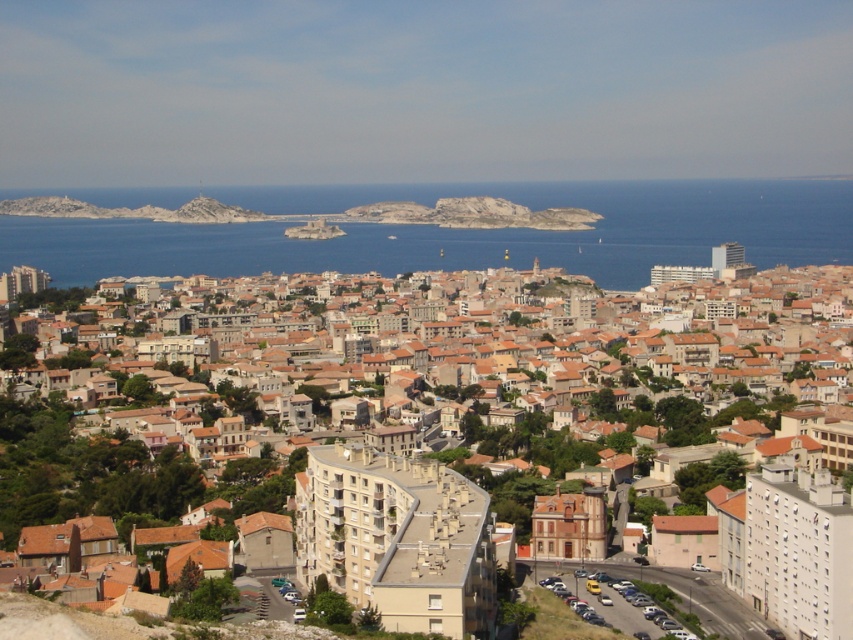
Question: Among these points, which one is farthest from the camera?

Choices:
 (A) (254, 257)
 (B) (401, 436)

Answer: (A)

Question: Which object is closer to the camera taking this photo?

Choices:
 (A) brown textured buildings at center
 (B) blue water at center

Answer: (A)

Question: Is brown textured buildings at center positioned in front of blue water at center?

Choices:
 (A) no
 (B) yes

Answer: (B)

Question: Does brown textured buildings at center have a greater width compared to blue water at center?

Choices:
 (A) no
 (B) yes

Answer: (A)

Question: Among these points, which one is farthest from the camera?

Choices:
 (A) (76, 280)
 (B) (735, 433)

Answer: (A)

Question: Does brown textured buildings at center have a larger size compared to blue water at center?

Choices:
 (A) no
 (B) yes

Answer: (B)